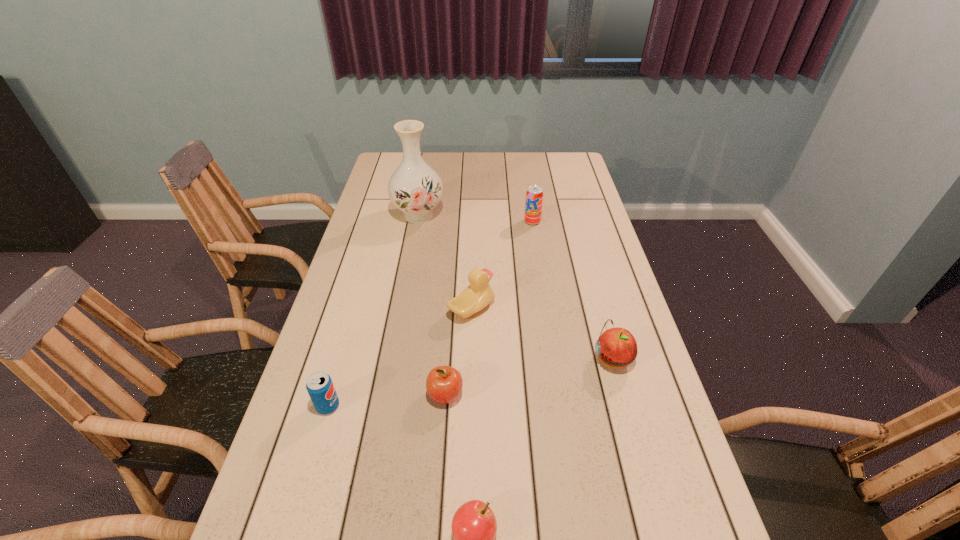
At what (x,y) coordinates should I click in order to perform the action: click on the closest apple to the vase. Please return your answer as a coordinate pair (x, y). Looking at the image, I should click on point(444,384).